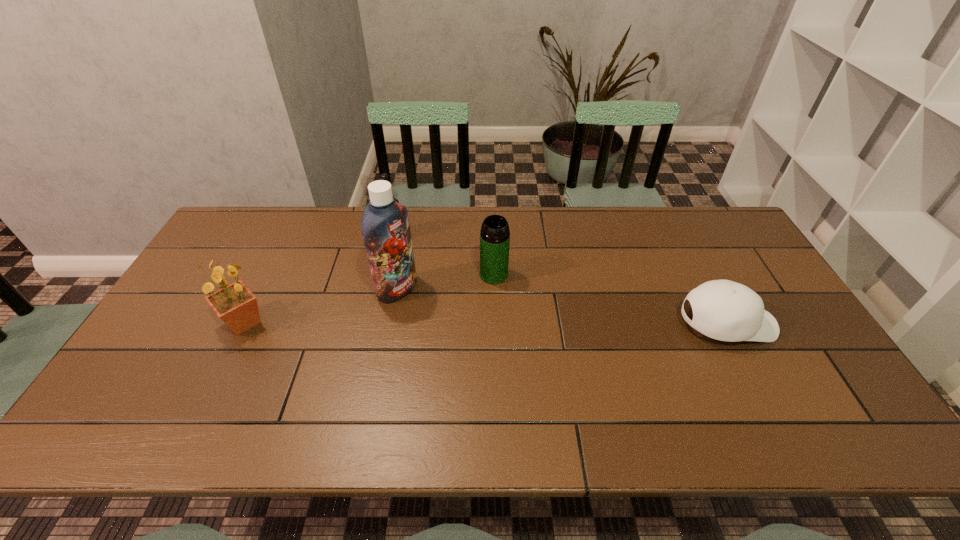
Image resolution: width=960 pixels, height=540 pixels. I want to click on free space at the far edge of the desktop, so click(x=444, y=213).

Image resolution: width=960 pixels, height=540 pixels. I want to click on vacant space at the near edge, so click(x=371, y=372).

Identify the location of vacant space at the left edge. (216, 265).

Image resolution: width=960 pixels, height=540 pixels. Identify the location of vacant area at the far right corner of the desktop. (716, 220).

Where is `vacant point at the near right corner`? The width and height of the screenshot is (960, 540). vacant point at the near right corner is located at coordinates (804, 377).

Identify the location of vacant area that lies between the baseball cap and the farthest object. (561, 280).

This screenshot has height=540, width=960. I want to click on blank region between the rightmost object and the farthest object, so click(561, 280).

The width and height of the screenshot is (960, 540). I want to click on vacant space that is in between the tallest object and the thermos bottle, so click(445, 282).

At what (x,y) coordinates should I click in order to perform the action: click on vacant space that's between the rightmost object and the shampoo. Please return your answer as a coordinate pair (x, y). Looking at the image, I should click on (562, 306).

The image size is (960, 540). In order to click on free space that is in between the sunflower and the shortest object in this screenshot , I will do `click(485, 323)`.